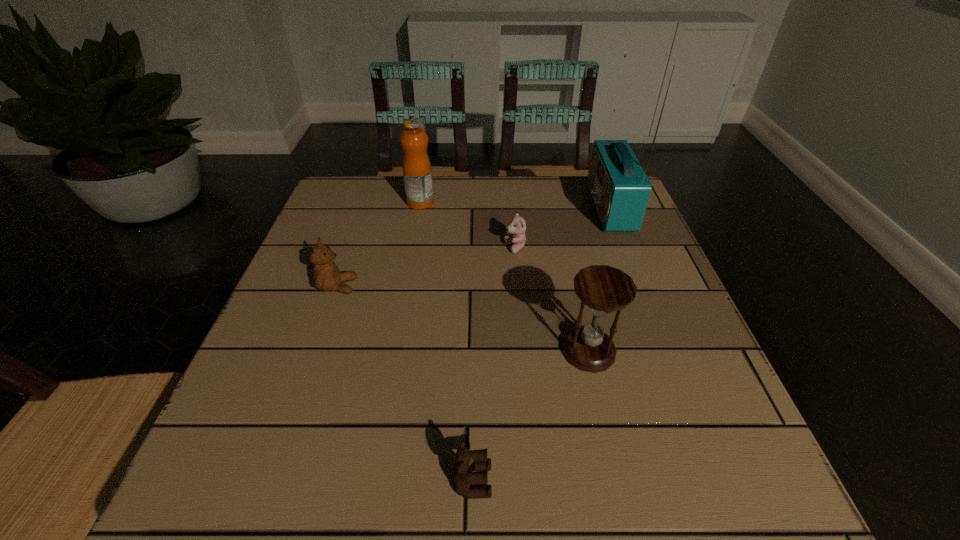
Where is `the nearest object`? The image size is (960, 540). the nearest object is located at coordinates (468, 462).

Where is `the second teddy bear from left to right`? This screenshot has height=540, width=960. the second teddy bear from left to right is located at coordinates (468, 462).

At what (x,y) coordinates should I click in order to perform the action: click on blank space located on the front panel of the tallest object. Please return your answer as a coordinate pair (x, y). The height and width of the screenshot is (540, 960). Looking at the image, I should click on (452, 207).

Find the location of a particular element. The image size is (960, 540). vacant region located 0.200m on the front panel of the tallest object is located at coordinates (514, 207).

Where is `vacant region located on the front panel of the tallest object`? This screenshot has height=540, width=960. vacant region located on the front panel of the tallest object is located at coordinates (487, 207).

At what (x,y) coordinates should I click in order to perform the action: click on vacant space situated on the front of the fifth object from right to left. Please return your answer as a coordinate pair (x, y). The width and height of the screenshot is (960, 540). Looking at the image, I should click on (413, 241).

Identify the location of free location located 0.300m on the left of the fourth shortest object. (396, 351).

You are a GUI agent. You are given a task and a screenshot of the screen. Output one action in this format:
    pyautogui.click(x=<x>, y=<y>)
    Task: Click on the vacant position located on the face of the second nearest teddy bear
    
    Given the screenshot: What is the action you would take?
    pyautogui.click(x=538, y=286)

Locate an element on the screen. Image resolution: width=960 pixels, height=540 pixels. vacant space located at the face of the fourth object from left to right is located at coordinates click(409, 248).

You are a GUI agent. You are given a task and a screenshot of the screen. Output one action in this format:
    pyautogui.click(x=<x>, y=<y>)
    Task: Click on the free region located at the face of the fourth object from left to right
    The height and width of the screenshot is (540, 960).
    Given the screenshot: What is the action you would take?
    pyautogui.click(x=444, y=248)